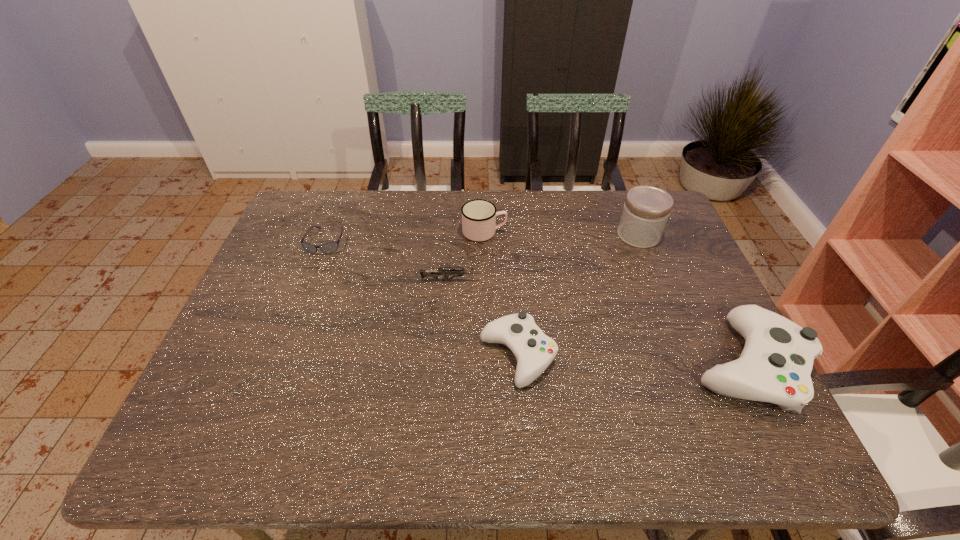
Locate an element on the screen. The width and height of the screenshot is (960, 540). vacant region at the far right corner of the desktop is located at coordinates (670, 213).

Find the location of a particular element. This screenshot has height=540, width=960. vacant space that's between the fifth tallest object and the right control is located at coordinates (600, 322).

Identify the location of free space between the sunglasses and the mug. (405, 237).

The image size is (960, 540). What are the coordinates of `empty location between the mug and the leftmost object` in the screenshot? It's located at (405, 237).

The image size is (960, 540). I want to click on empty location between the tallest object and the second shortest object, so click(x=544, y=258).

Where is `vacant space that's between the left control and the taller control`? The width and height of the screenshot is (960, 540). vacant space that's between the left control and the taller control is located at coordinates coord(633,360).

Find the location of a particular element. free area in between the mug and the jar is located at coordinates (562, 233).

At what (x,y) coordinates should I click in order to perform the action: click on vacant area between the mug and the right control. Please return your answer as a coordinate pair (x, y). This screenshot has height=540, width=960. Looking at the image, I should click on (616, 298).

Find the location of a particular element. vacant area that lies between the mug and the right control is located at coordinates (616, 298).

This screenshot has width=960, height=540. In order to click on free area in between the taller control and the shorter control in this screenshot , I will do `click(633, 360)`.